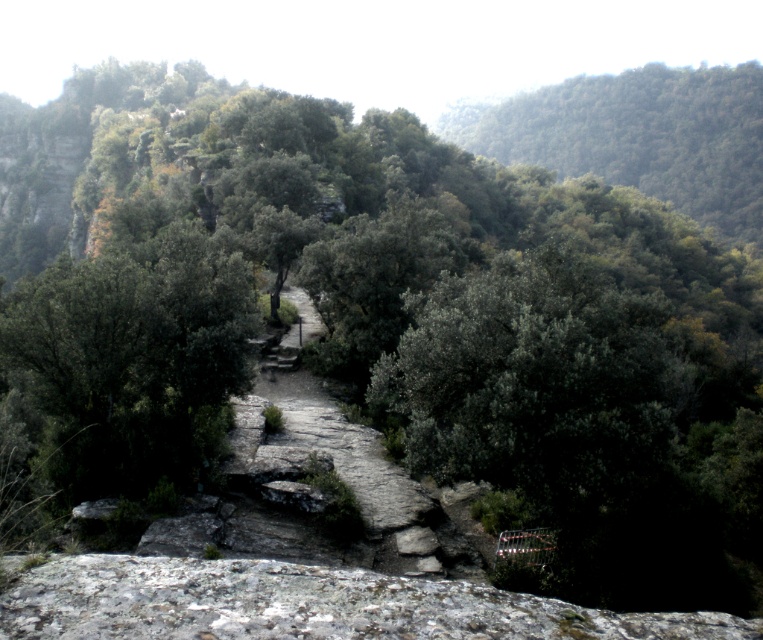
You are a hiker standing on the gray rough rock at lower center and want to reach the green leafy tree at upper center. Which direction should you move to get closer to the tree?

The gray rough rock at lower center is located below the green leafy tree at upper center, so you should move upward to get closer to the tree.

You are a hiker carrying a backpack and need to cross the rocky path. The gray rough rock at lower center and the green leafy tree at upper center are in your path. Which object is wider, and will you need to adjust your path to avoid the wider one?

The green leafy tree at upper center is wider than the gray rough rock at lower center. Since the tree is wider, you may need to adjust your path to avoid it.

You are a hiker standing on the gray rough rock at lower center and want to reach the green leafy tree at upper center. Which direction should you move to get closer to the tree?

The gray rough rock at lower center is closer to the viewer than the green leafy tree at upper center, so to reach the tree, you should move forward along the path towards the upper center direction where the tree is located.